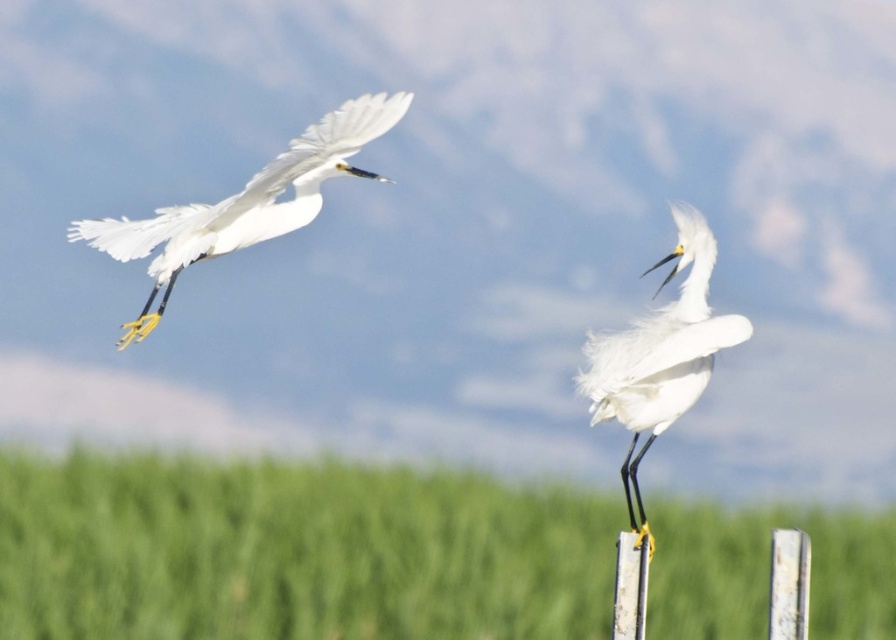
You are an ornithologist observing two birds in a serene outdoor scene. The scene includes a white feathered bird at left and a white fluffy bird at center. Based on their sizes, which bird would cast a wider shadow on the ground?

The white feathered bird at left has a larger width than the white fluffy bird at center, so it would cast a wider shadow on the ground.

You are a birdwatcher observing the two birds in the image. Which bird, the white feathered bird at left or the white fluffy bird at center, is shorter in height?

The white feathered bird at left is shorter than the white fluffy bird at center.